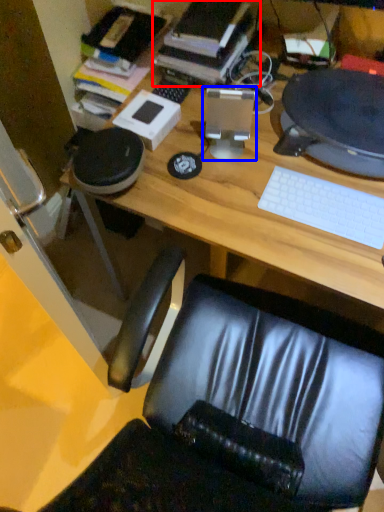
Question: Which of the following is the farthest to the observer, book (highlighted by a red box) or desktop computer (highlighted by a blue box)?

Choices:
 (A) book
 (B) desktop computer

Answer: (A)